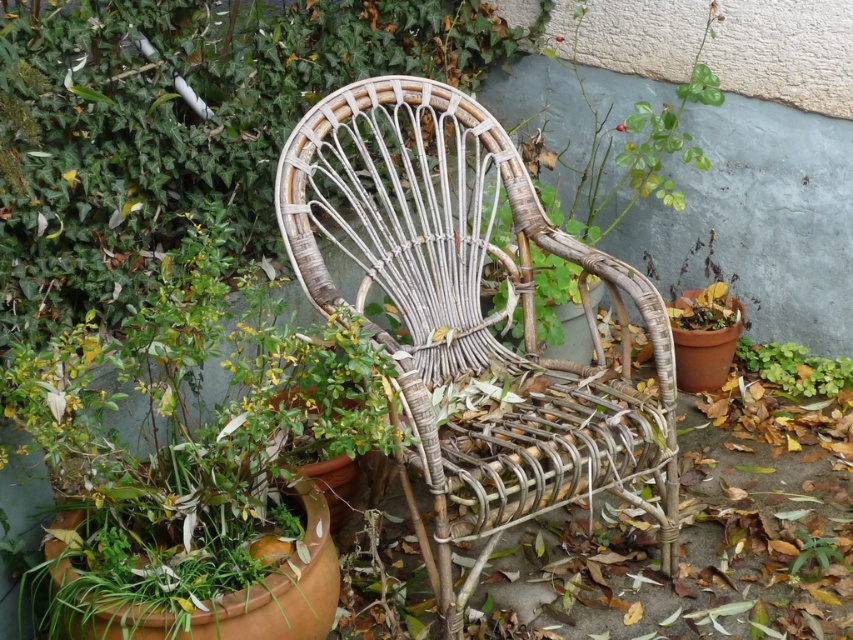
Question: Does woven bamboo chair at center have a larger size compared to green leafy plant at lower right?

Choices:
 (A) yes
 (B) no

Answer: (A)

Question: Does woven bamboo chair at center appear on the right side of green leafy plant at lower right?

Choices:
 (A) yes
 (B) no

Answer: (B)

Question: Which point is closer to the camera taking this photo?

Choices:
 (A) (817, 554)
 (B) (659, 141)

Answer: (A)

Question: Does woven bamboo chair at center appear on the right side of green leafy plant at center?

Choices:
 (A) no
 (B) yes

Answer: (A)

Question: Which point is closer to the camera taking this photo?

Choices:
 (A) (352, 195)
 (B) (795, 348)
 (C) (701, 33)

Answer: (A)

Question: Among these objects, which one is nearest to the camera?

Choices:
 (A) green leafy plant at lower center
 (B) green leafy plant at center
 (C) woven bamboo chair at center

Answer: (C)